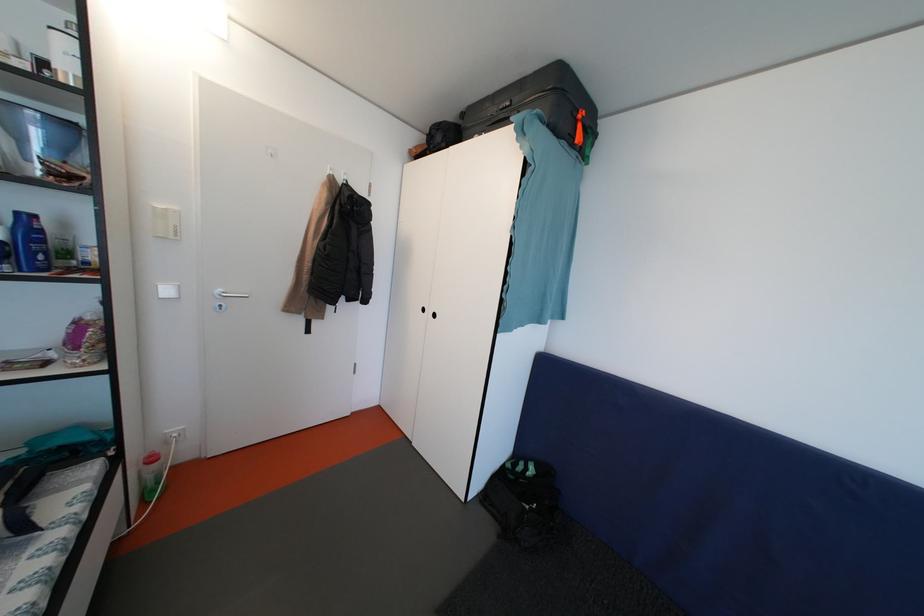
In order to click on silver door handle in this screenshot , I will do `click(225, 297)`.